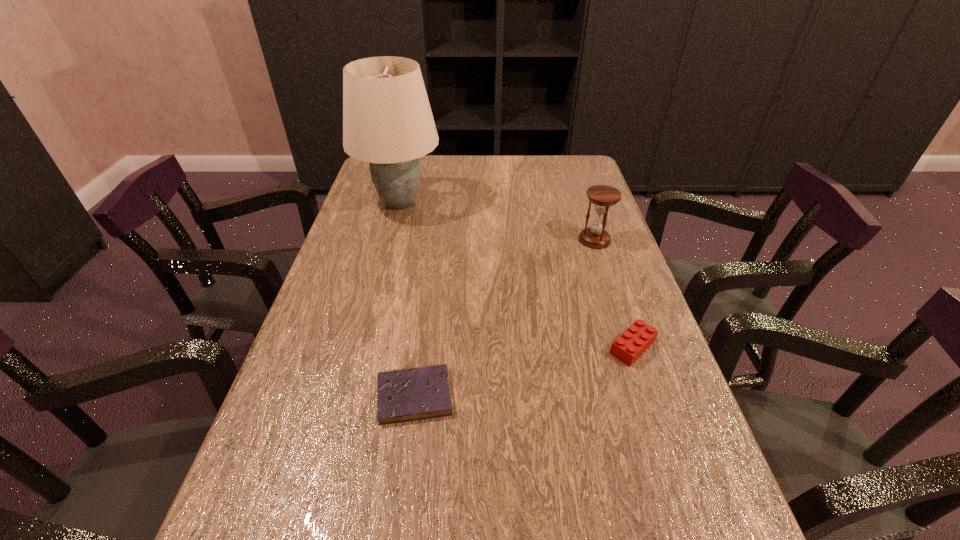
This screenshot has height=540, width=960. What are the coordinates of `vacant space located on the back of the second nearest object` in the screenshot? It's located at pyautogui.click(x=612, y=287).

The width and height of the screenshot is (960, 540). In order to click on vacant area located on the front of the nearest object in this screenshot , I will do `click(397, 526)`.

Find the location of a particular element. object situated at the far edge is located at coordinates click(387, 120).

You are a GUI agent. You are given a task and a screenshot of the screen. Output one action in this format:
    pyautogui.click(x=<x>, y=<y>)
    Task: Click on the object that is at the left edge
    The height and width of the screenshot is (540, 960).
    Given the screenshot: What is the action you would take?
    pyautogui.click(x=387, y=120)

You are a GUI agent. You are given a task and a screenshot of the screen. Output one action in this format:
    pyautogui.click(x=<x>, y=<y>)
    Task: Click on the hourglass at the right edge
    The width and height of the screenshot is (960, 540).
    Given the screenshot: What is the action you would take?
    pyautogui.click(x=603, y=196)

Identify the location of Lego present at the right edge. (633, 342).

This screenshot has height=540, width=960. What are the coordinates of `object that is positioned at the far left corner` in the screenshot? It's located at (387, 120).

Identify the location of vacant space at the far edge of the desktop. This screenshot has height=540, width=960. (538, 181).

Where is `free space at the left edge of the desktop`? The height and width of the screenshot is (540, 960). free space at the left edge of the desktop is located at coordinates (313, 359).

At what (x,y) coordinates should I click in order to perform the action: click on vacant region at the right edge. Please return your answer as a coordinate pair (x, y). Image resolution: width=960 pixels, height=540 pixels. Looking at the image, I should click on click(x=633, y=310).